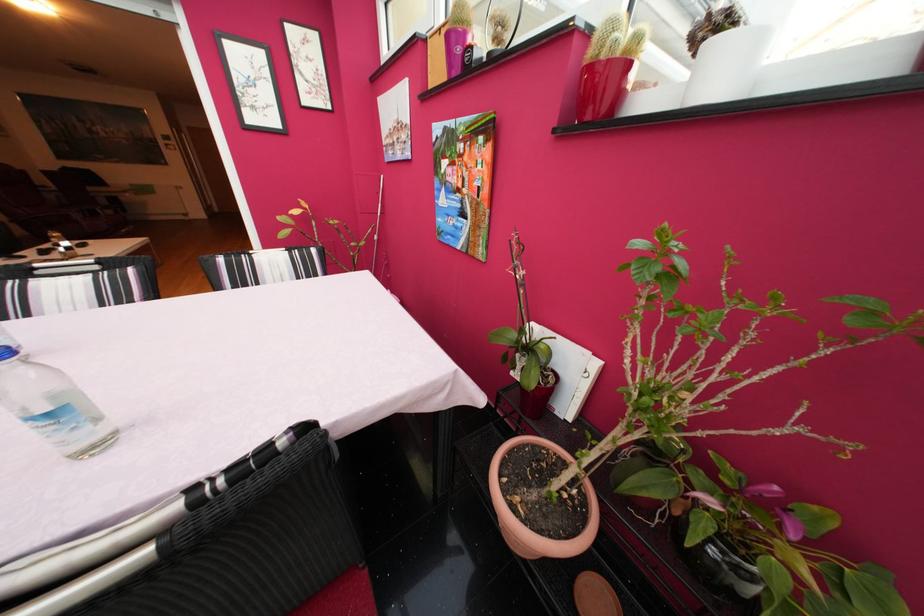
The image size is (924, 616). In order to click on red plant pot in this screenshot , I will do `click(602, 87)`.